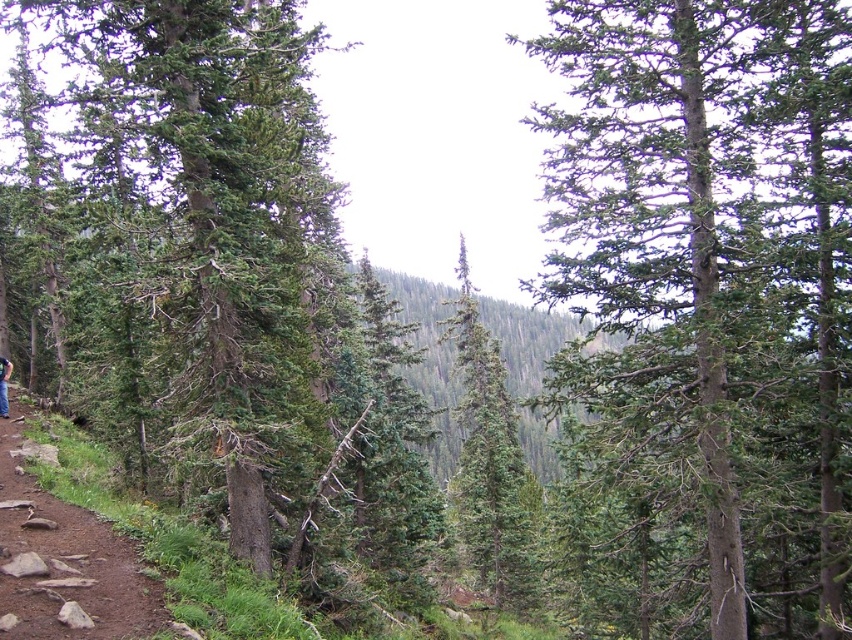
You are standing at the starting point of the dirt path in the forest scene. You need to locate the green rough bark tree at center. According to the coordinates provided, where should you look relative to your position?

The green rough bark tree at center is located at coordinates 0.463 on the x axis and 0.835 on the y axis. Since the coordinate system starts at the bottom left corner, this places the tree to the right and slightly above your current position on the path.

You are a hiker walking along the dirt path in the forest. You notice two trees at the center of your view, a green rough bark tree at center and a green matte tree at center. Which tree is wider?

The green rough bark tree at center is wider than the green matte tree at center.

You are standing at the starting point of the dirt path in the forest. You notice two points marked on the path. The first point is at coordinates point (567, 154) and the second point is at point (15, 420). If you were to walk along the path from your current position, which point would you encounter first?

Point (567, 154) is in front of point (15, 420), so you would encounter point (567, 154) first as you walk along the path.